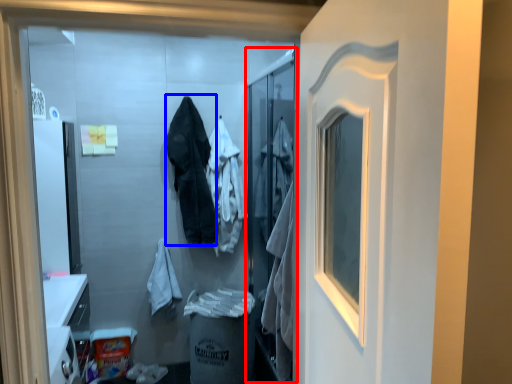
Question: Which point is closer to the camera, screen door (highlighted by a red box) or clothing (highlighted by a blue box)?

Choices:
 (A) screen door
 (B) clothing

Answer: (A)